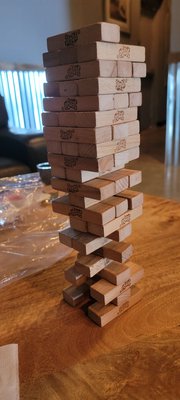
Find the location of `objects on table`. objects on table is located at coordinates (40, 198), (41, 172), (6, 222), (13, 194).